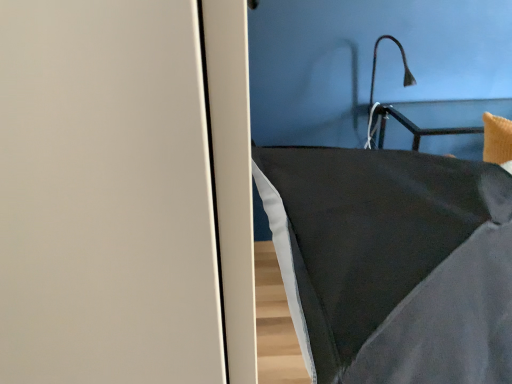
Question: Is black matte lamp at upper right not inside dark gray fabric pillow at center?

Choices:
 (A) yes
 (B) no

Answer: (A)

Question: Is black matte lamp at upper right taller than dark gray fabric pillow at center?

Choices:
 (A) yes
 (B) no

Answer: (B)

Question: Would you consider black matte lamp at upper right to be distant from dark gray fabric pillow at center?

Choices:
 (A) yes
 (B) no

Answer: (A)

Question: Is black matte lamp at upper right shorter than dark gray fabric pillow at center?

Choices:
 (A) no
 (B) yes

Answer: (B)

Question: From the image's perspective, is black matte lamp at upper right on top of dark gray fabric pillow at center?

Choices:
 (A) no
 (B) yes

Answer: (B)

Question: From a real-world perspective, is black matte lamp at upper right located higher than dark gray fabric pillow at center?

Choices:
 (A) no
 (B) yes

Answer: (B)

Question: Is black matte lamp at upper right surrounded by dark gray fabric pillow at center?

Choices:
 (A) no
 (B) yes

Answer: (A)

Question: Is dark gray fabric pillow at center closer to the viewer compared to black matte lamp at upper right?

Choices:
 (A) yes
 (B) no

Answer: (A)

Question: Would you say dark gray fabric pillow at center is outside black matte lamp at upper right?

Choices:
 (A) yes
 (B) no

Answer: (A)

Question: Is dark gray fabric pillow at center bigger than black matte lamp at upper right?

Choices:
 (A) yes
 (B) no

Answer: (A)

Question: Is dark gray fabric pillow at center further to the viewer compared to black matte lamp at upper right?

Choices:
 (A) yes
 (B) no

Answer: (B)

Question: Is dark gray fabric pillow at center directly adjacent to black matte lamp at upper right?

Choices:
 (A) yes
 (B) no

Answer: (B)

Question: In the image, is dark gray fabric pillow at center positioned in front of or behind black matte lamp at upper right?

Choices:
 (A) front
 (B) behind

Answer: (A)